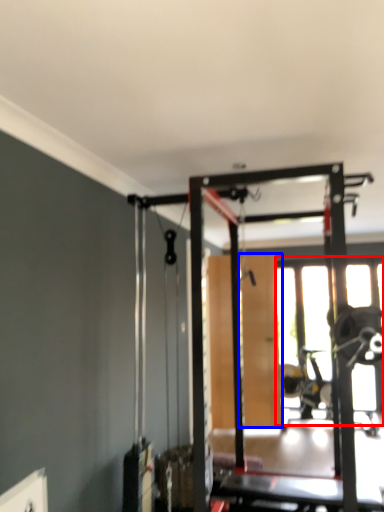
Question: Which of the following is the closest to the observer, window (highlighted by a red box) or screen door (highlighted by a blue box)?

Choices:
 (A) window
 (B) screen door

Answer: (B)